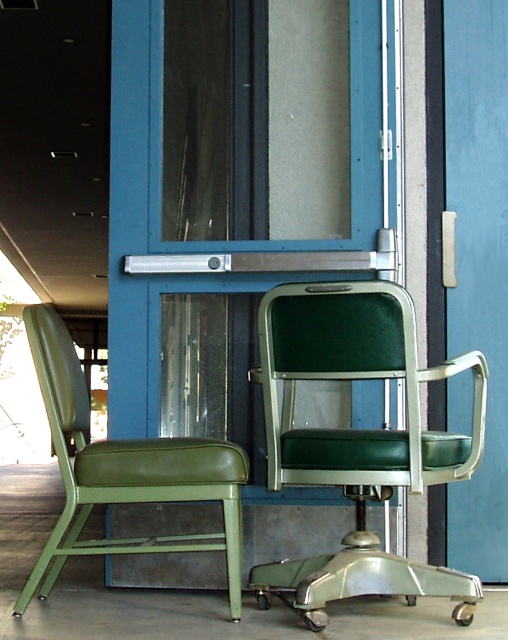
Question: Considering the relative positions of green leather swivel chair at center and green leather chair at left in the image provided, where is green leather swivel chair at center located with respect to green leather chair at left?

Choices:
 (A) below
 (B) above

Answer: (B)

Question: Among these points, which one is nearest to the camera?

Choices:
 (A) (238, 580)
 (B) (389, 433)

Answer: (A)

Question: Which point appears farthest from the camera in this image?

Choices:
 (A) (398, 476)
 (B) (143, 477)

Answer: (B)

Question: In this image, where is green leather swivel chair at center located relative to green leather chair at left?

Choices:
 (A) right
 (B) left

Answer: (A)

Question: Does green leather swivel chair at center appear on the right side of green leather chair at left?

Choices:
 (A) no
 (B) yes

Answer: (B)